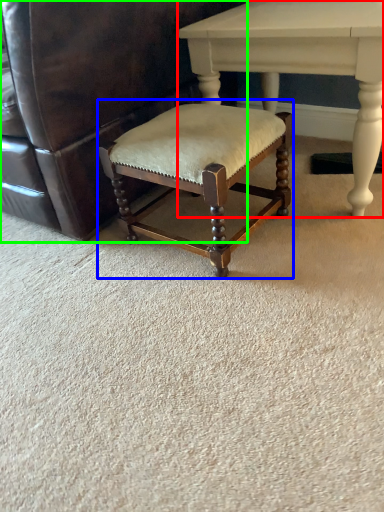
Question: Which object is the closest to the table (highlighted by a red box)? Choose among these: bar stool (highlighted by a blue box) or chair (highlighted by a green box).

Choices:
 (A) bar stool
 (B) chair

Answer: (A)